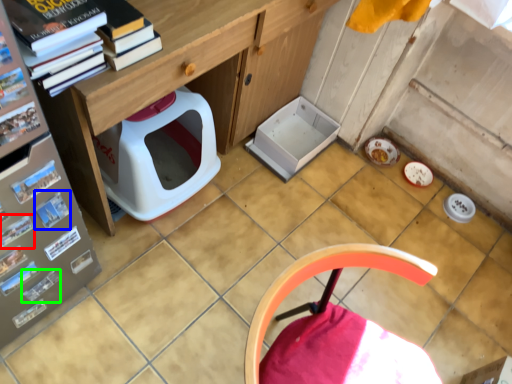
Question: Which object is the closest to the magazine (highlighted by a red box)? Choose among these: magazine (highlighted by a blue box) or magazine (highlighted by a green box).

Choices:
 (A) magazine
 (B) magazine

Answer: (A)